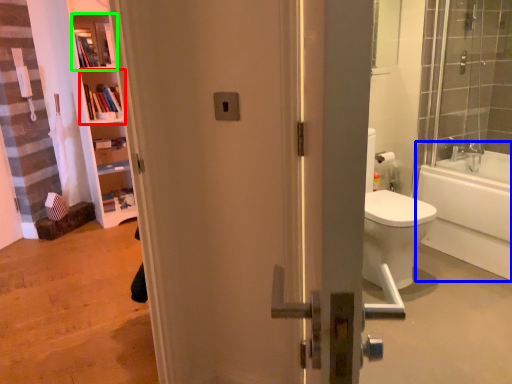
Question: Which is nearer to the shelf (highlighted by a red box)? bathtub (highlighted by a blue box) or shelf (highlighted by a green box).

Choices:
 (A) bathtub
 (B) shelf

Answer: (B)